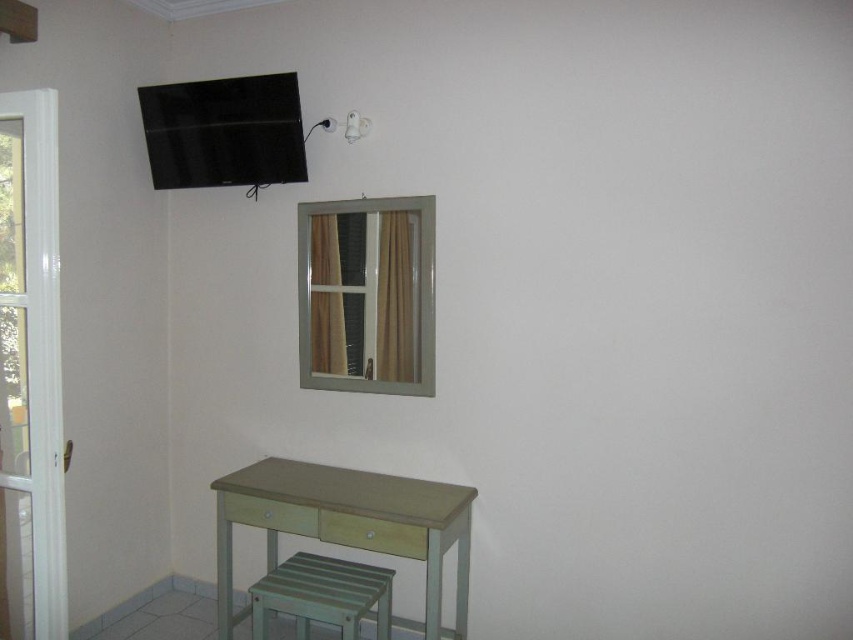
Which is behind, point (248, 492) or point (335, 579)?

The point (248, 492) is behind.

Between light green wooden table at lower left and matte green stool at lower left, which one has more height?

light green wooden table at lower left is taller.

Does point (463, 608) come in front of point (289, 589)?

No, (463, 608) is further to viewer.

Identify the location of light green wooden table at lower left. The height and width of the screenshot is (640, 853). coord(347,524).

The width and height of the screenshot is (853, 640). What do you see at coordinates (367, 294) in the screenshot? I see `metallic frame window at center` at bounding box center [367, 294].

Does metallic frame window at center lie behind light green wooden table at lower left?

Yes, metallic frame window at center is further from the viewer.

Image resolution: width=853 pixels, height=640 pixels. I want to click on metallic frame window at center, so click(x=367, y=294).

You are a GUI agent. You are given a task and a screenshot of the screen. Output one action in this format:
    pyautogui.click(x=<x>, y=<y>)
    Task: Click on the metallic frame window at center
    The width and height of the screenshot is (853, 640).
    Given the screenshot: What is the action you would take?
    pyautogui.click(x=367, y=294)

Who is positioned more to the left, metallic frame window at center or matte green stool at lower left?

matte green stool at lower left

Is metallic frame window at center smaller than matte green stool at lower left?

Yes.

Who is more distant from viewer, (357, 248) or (270, 589)?

The point (357, 248) is more distant.

At what (x,y) coordinates should I click in order to perform the action: click on metallic frame window at center. Please return your answer as a coordinate pair (x, y). Looking at the image, I should click on (367, 294).